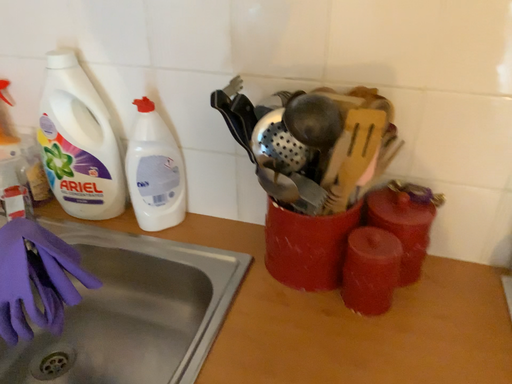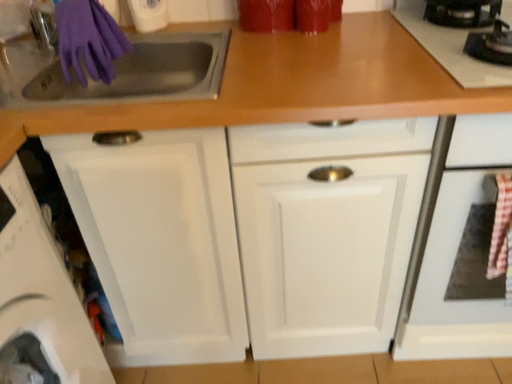
Question: How did the camera likely rotate when shooting the video?

Choices:
 (A) rotated left
 (B) rotated right

Answer: (B)